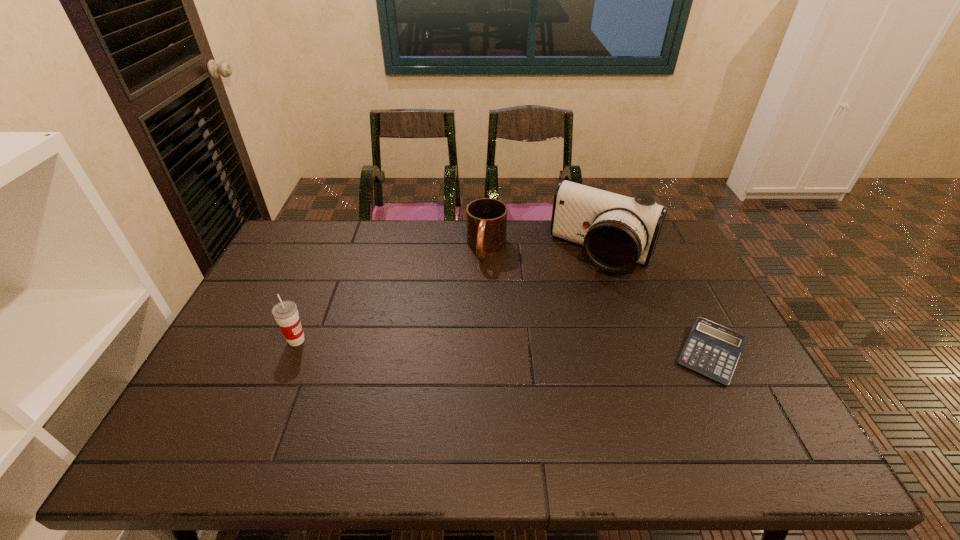
Where is `vacant area that lies between the third shortest object and the calculator`? The width and height of the screenshot is (960, 540). vacant area that lies between the third shortest object and the calculator is located at coordinates (504, 347).

This screenshot has height=540, width=960. Identify the location of free space between the shortest object and the leftmost object. (504, 347).

Locate an element on the screen. This screenshot has width=960, height=540. vacant area that lies between the third object from right to left and the camcorder is located at coordinates (544, 251).

Find the location of a particular element. The image size is (960, 540). blank region between the second object from left to right and the tallest object is located at coordinates (544, 251).

At what (x,y) coordinates should I click in order to perform the action: click on free point between the cup and the third object from right to left. Please return your answer as a coordinate pair (x, y). Looking at the image, I should click on (392, 294).

Locate an element on the screen. free space that is in between the shortest object and the mug is located at coordinates (599, 301).

Image resolution: width=960 pixels, height=540 pixels. Identify the location of free spot between the second tallest object and the calculator. (504, 347).

At what (x,y) coordinates should I click in order to perform the action: click on the closest object to the second object from left to right. Please return your answer as a coordinate pair (x, y). This screenshot has width=960, height=540. Looking at the image, I should click on (616, 231).

Image resolution: width=960 pixels, height=540 pixels. Find the location of `the third closest object to the tallest object`. the third closest object to the tallest object is located at coordinates click(x=285, y=313).